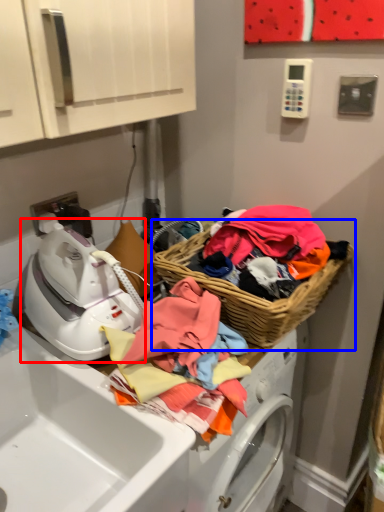
Question: Which of the following is the closest to the observer, washer (highlighted by a red box) or picnic basket (highlighted by a blue box)?

Choices:
 (A) washer
 (B) picnic basket

Answer: (A)